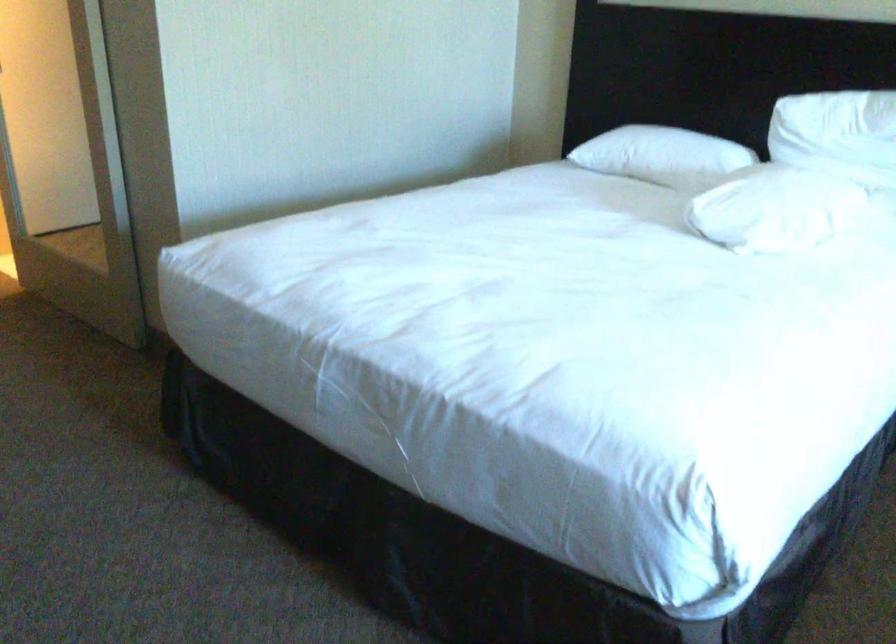
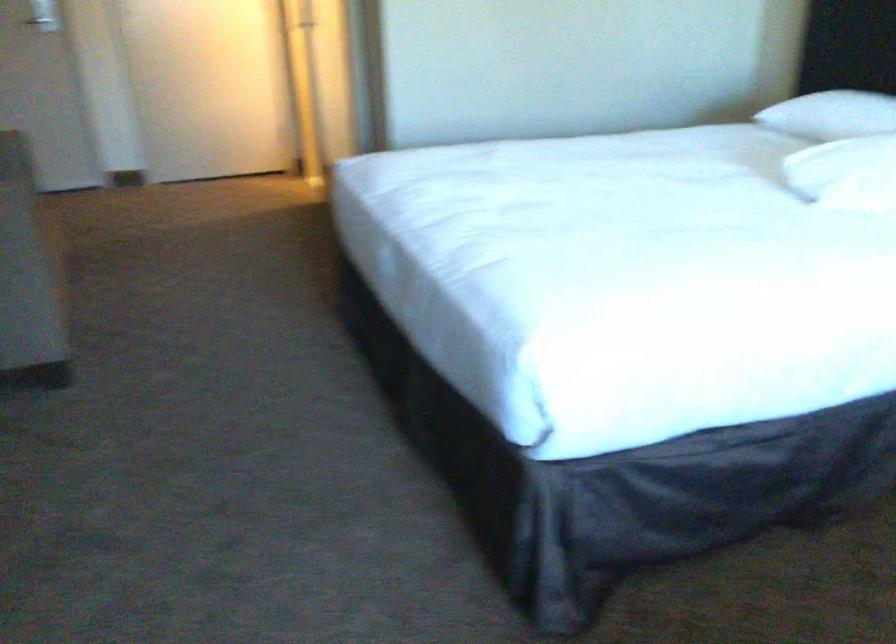
In the second image, find the point that corresponds to pixel 773 216 in the first image.

(846, 173)